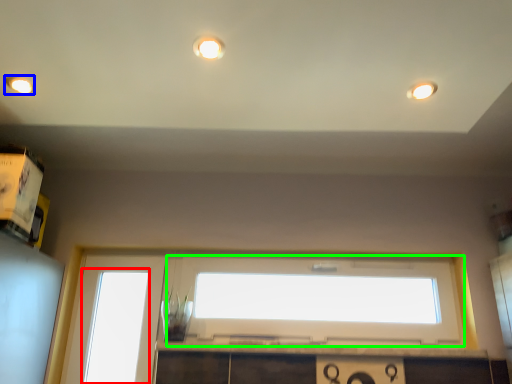
Question: Estimate the real-world distances between objects in this image. Which object is farther from window (highlighted by a red box), lighting (highlighted by a blue box) or window (highlighted by a green box)?

Choices:
 (A) lighting
 (B) window

Answer: (A)